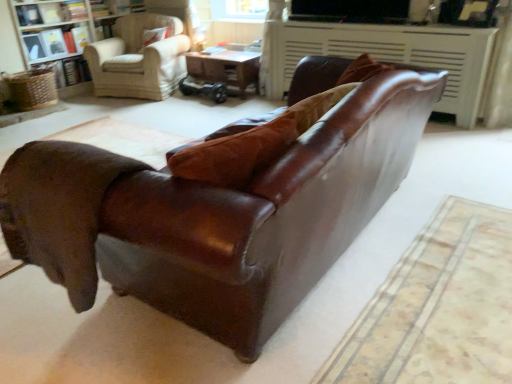
What is the approximate width of brown leather fireplace at upper center?

brown leather fireplace at upper center is 41.35 centimeters wide.

Image resolution: width=512 pixels, height=384 pixels. What do you see at coordinates (392, 55) in the screenshot?
I see `brown leather fireplace at upper center` at bounding box center [392, 55].

The width and height of the screenshot is (512, 384). I want to click on suede-like brown pillow at upper left, so click(x=157, y=35).

Image resolution: width=512 pixels, height=384 pixels. What do you see at coordinates (139, 59) in the screenshot?
I see `light beige fabric armchair at upper left` at bounding box center [139, 59].

Locate an element on the screen. Image resolution: width=512 pixels, height=384 pixels. brown leather fireplace at upper center is located at coordinates (392, 55).

From the image's perspective, is wooden table at center under shiny brown leather couch at center?

Actually, wooden table at center appears above shiny brown leather couch at center in the image.

Considering the relative sizes of wooden table at center and shiny brown leather couch at center in the image provided, is wooden table at center wider than shiny brown leather couch at center?

No, wooden table at center is not wider than shiny brown leather couch at center.

Are wooden table at center and shiny brown leather couch at center beside each other?

They are not placed beside each other.

Which of these two, wooden table at center or shiny brown leather couch at center, is smaller?

wooden table at center is smaller.

Is wooden table at center positioned with its back to light beige fabric armchair at upper left?

No.

Considering the sizes of objects wooden table at center and light beige fabric armchair at upper left in the image provided, who is smaller, wooden table at center or light beige fabric armchair at upper left?

With smaller size is wooden table at center.

Consider the image. Which object is further away from the camera taking this photo, wooden table at center or light beige fabric armchair at upper left?

wooden table at center.

Which is behind, shiny brown leather couch at center or suede-like brown pillow at upper left?

suede-like brown pillow at upper left is further away from the camera.

From the image's perspective, is shiny brown leather couch at center over suede-like brown pillow at upper left?

No, from the image's perspective, shiny brown leather couch at center is not above suede-like brown pillow at upper left.

How different are the orientations of shiny brown leather couch at center and suede-like brown pillow at upper left in degrees?

98.6 degrees.

Is shiny brown leather couch at center beside suede-like brown pillow at upper left?

No, shiny brown leather couch at center is not making contact with suede-like brown pillow at upper left.

Is shiny brown leather couch at center next to white textured bookcase at upper left?

No, shiny brown leather couch at center is not touching white textured bookcase at upper left.

Is point (246, 300) closer to viewer compared to point (51, 10)?

Yes.

Is white textured bookcase at upper left a part of shiny brown leather couch at center?

Definitely not — white textured bookcase at upper left is not inside shiny brown leather couch at center.

From a real-world perspective, is suede-like brown pillow at upper left located beneath white textured bookcase at upper left?

Incorrect, from a real-world perspective, suede-like brown pillow at upper left is higher than white textured bookcase at upper left.

Looking at their sizes, would you say suede-like brown pillow at upper left is wider or thinner than white textured bookcase at upper left?

Clearly, suede-like brown pillow at upper left has less width compared to white textured bookcase at upper left.

Considering the relative sizes of suede-like brown pillow at upper left and white textured bookcase at upper left in the image provided, is suede-like brown pillow at upper left bigger than white textured bookcase at upper left?

No, suede-like brown pillow at upper left is not bigger than white textured bookcase at upper left.

Is white textured bookcase at upper left inside suede-like brown pillow at upper left?

No, white textured bookcase at upper left is located outside of suede-like brown pillow at upper left.

Is shiny brown leather couch at center to the left of brown leather fireplace at upper center from the viewer's perspective?

Yes.

Image resolution: width=512 pixels, height=384 pixels. In order to click on fireplace that appears behind the shiny brown leather couch at center in this screenshot , I will do `click(392, 55)`.

Which object is closer to the camera, shiny brown leather couch at center or brown leather fireplace at upper center?

shiny brown leather couch at center is closer to the camera.

Considering the relative sizes of shiny brown leather couch at center and brown leather fireplace at upper center in the image provided, is shiny brown leather couch at center smaller than brown leather fireplace at upper center?

No, shiny brown leather couch at center is not smaller than brown leather fireplace at upper center.

From the image's perspective, is suede-like brown pillow at upper left above or below shiny brown leather couch at center?

Based on their image positions, suede-like brown pillow at upper left is located above shiny brown leather couch at center.

Is suede-like brown pillow at upper left closer to camera compared to shiny brown leather couch at center?

No.

Can you confirm if suede-like brown pillow at upper left is positioned to the right of shiny brown leather couch at center?

No.

Identify the location of table above the shiny brown leather couch at center (from the image's perspective). (225, 68).

Locate an element on the screen. table below the light beige fabric armchair at upper left (from a real-world perspective) is located at coordinates (225, 68).

Looking at the image, which one is located further to wooden table at center, shiny brown leather couch at center or white textured bookcase at upper left?

Among the two, shiny brown leather couch at center is located further to wooden table at center.

Considering their positions, is shiny brown leather couch at center positioned closer to white textured bookcase at upper left than suede-like brown pillow at upper left?

suede-like brown pillow at upper left is closer to white textured bookcase at upper left.

Considering their positions, is suede-like brown pillow at upper left positioned further to wooden table at center than white textured bookcase at upper left?

white textured bookcase at upper left lies further to wooden table at center than the other object.

Which object lies nearer to the anchor point white textured bookcase at upper left, brown leather fireplace at upper center or wooden table at center?

wooden table at center is closer to white textured bookcase at upper left.

Which object lies further to the anchor point light beige fabric armchair at upper left, brown leather fireplace at upper center or white textured bookcase at upper left?

brown leather fireplace at upper center is further to light beige fabric armchair at upper left.

Estimate the real-world distances between objects in this image. Which object is further from suede-like brown pillow at upper left, light beige fabric armchair at upper left or white textured bookcase at upper left?

white textured bookcase at upper left is further to suede-like brown pillow at upper left.

Looking at the image, which one is located closer to wooden table at center, light beige fabric armchair at upper left or shiny brown leather couch at center?

light beige fabric armchair at upper left.

In the scene shown: Considering their positions, is brown leather fireplace at upper center positioned further to suede-like brown pillow at upper left than light beige fabric armchair at upper left?

Based on the image, brown leather fireplace at upper center appears to be further to suede-like brown pillow at upper left.

You are a GUI agent. You are given a task and a screenshot of the screen. Output one action in this format:
    pyautogui.click(x=<x>, y=<y>)
    Task: Click on the pillow between white textured bookcase at upper left and brown leather fireplace at upper center in the horizontal direction
    
    Given the screenshot: What is the action you would take?
    pyautogui.click(x=157, y=35)

At what (x,y) coordinates should I click in order to perform the action: click on chair positioned between shiny brown leather couch at center and wooden table at center from near to far. Please return your answer as a coordinate pair (x, y). The width and height of the screenshot is (512, 384). Looking at the image, I should click on (139, 59).

I want to click on fireplace between shiny brown leather couch at center and wooden table at center from front to back, so click(x=392, y=55).

Image resolution: width=512 pixels, height=384 pixels. I want to click on bookcase located between shiny brown leather couch at center and light beige fabric armchair at upper left in the depth direction, so click(55, 34).